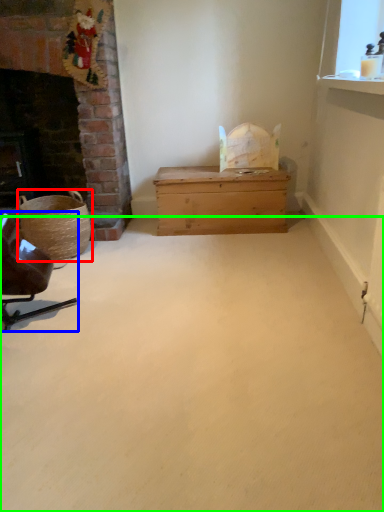
Question: Which is nearer to the basket (highlighted by a red box)? chair (highlighted by a blue box) or plain (highlighted by a green box).

Choices:
 (A) chair
 (B) plain

Answer: (A)